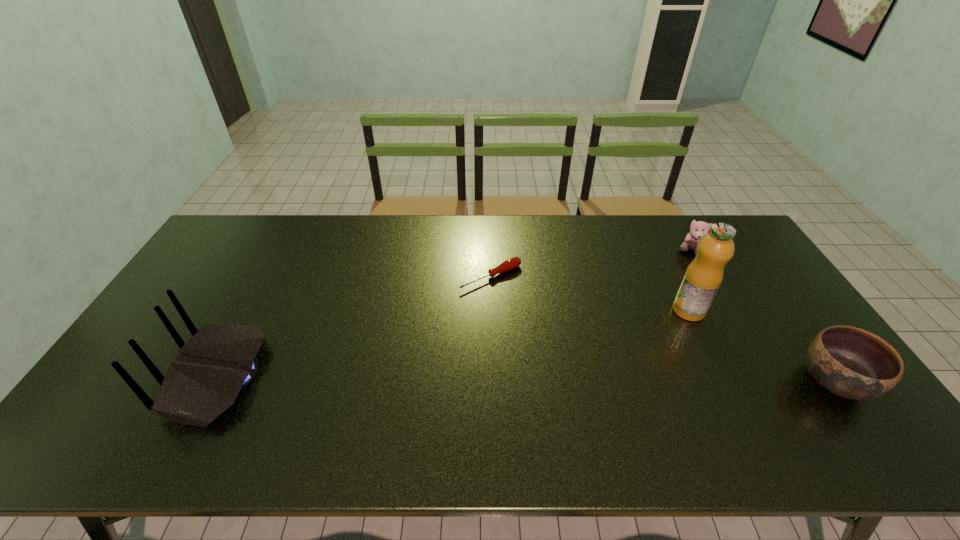
Identify the location of vacant region at the far right corner of the desktop. This screenshot has height=540, width=960. (690, 220).

At what (x,y) coordinates should I click in order to perform the action: click on unoccupied position between the screwdriver and the leftmost object. Please return your answer as a coordinate pair (x, y). This screenshot has height=540, width=960. Looking at the image, I should click on (354, 327).

This screenshot has height=540, width=960. Find the location of `empty space between the rightmost object and the router`. empty space between the rightmost object and the router is located at coordinates (527, 379).

Locate an element on the screen. Image resolution: width=960 pixels, height=540 pixels. vacant area that lies between the tallest object and the rightmost object is located at coordinates (761, 346).

In order to click on vacant region between the second farthest object and the farthest object in this screenshot , I will do (x=590, y=264).

Where is `empty space between the leftmost object and the bowl`? The height and width of the screenshot is (540, 960). empty space between the leftmost object and the bowl is located at coordinates (527, 379).

I want to click on vacant area that lies between the teddy bear and the fourth shortest object, so click(454, 314).

Locate an element on the screen. blank region between the second tallest object and the rightmost object is located at coordinates pyautogui.click(x=527, y=379).

Find the location of a particular element. The height and width of the screenshot is (540, 960). free space between the shortest object and the third farthest object is located at coordinates (589, 294).

Identify the location of free area in between the teddy bear and the leftmost object. The image size is (960, 540). (454, 314).